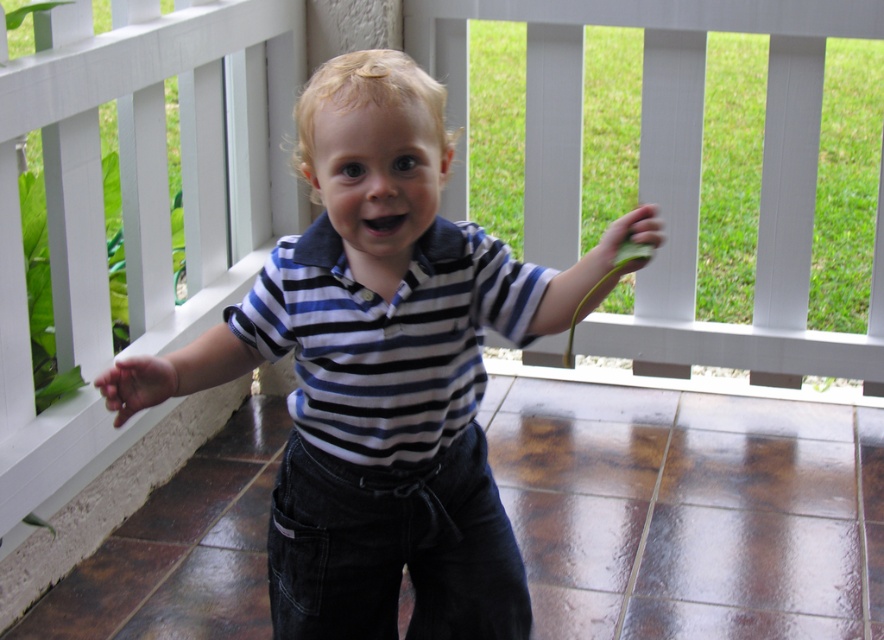
The child is wearing a striped cotton shirt at center and a blue striped shirt at center. Which one is bigger?

The striped cotton shirt at center is larger in size compared to the blue striped shirt at center.